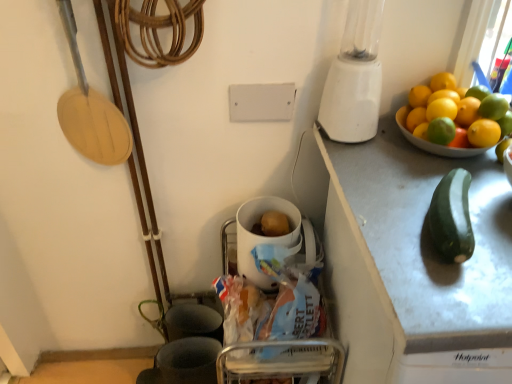
Question: Should I look upward or downward to see yellow matte lemon at right, the second lemon from the bottom?

Choices:
 (A) up
 (B) down

Answer: (A)

Question: Is green matte lemon at upper right, the 6th lemon viewed from the top, outside white glossy mug at center?

Choices:
 (A) no
 (B) yes

Answer: (B)

Question: From the image's perspective, is green matte lemon at upper right, the 6th lemon viewed from the top, on top of white glossy mug at center?

Choices:
 (A) yes
 (B) no

Answer: (A)

Question: Is green matte lemon at upper right, which appears as the 1th lemon when ordered from the bottom, turned away from white glossy mug at center?

Choices:
 (A) yes
 (B) no

Answer: (B)

Question: Is green matte lemon at upper right, which appears as the 1th lemon when ordered from the bottom, smaller than white glossy mug at center?

Choices:
 (A) no
 (B) yes

Answer: (B)

Question: Is green matte lemon at upper right, the 6th lemon viewed from the top, at the right side of white glossy mug at center?

Choices:
 (A) no
 (B) yes

Answer: (B)

Question: Could you tell me if green matte lemon at upper right, the 6th lemon viewed from the top, is turned towards white glossy mug at center?

Choices:
 (A) no
 (B) yes

Answer: (A)

Question: Considering the relative sizes of yellow matte lemon at upper right, arranged as the first lemon when viewed from the top, and yellow matte lemon at upper right, which is the second lemon from top to bottom, in the image provided, is yellow matte lemon at upper right, arranged as the first lemon when viewed from the top, shorter than yellow matte lemon at upper right, which is the second lemon from top to bottom,?

Choices:
 (A) no
 (B) yes

Answer: (A)

Question: Does yellow matte lemon at upper right, arranged as the first lemon when viewed from the top, have a smaller size compared to yellow matte lemon at upper right, which is the second lemon from top to bottom?

Choices:
 (A) no
 (B) yes

Answer: (A)

Question: Does yellow matte lemon at upper right, the sixth lemon positioned from the bottom, have a greater width compared to yellow matte lemon at upper right, which is counted as the 5th lemon, starting from the bottom?

Choices:
 (A) no
 (B) yes

Answer: (A)

Question: Considering the relative sizes of yellow matte lemon at upper right, the sixth lemon positioned from the bottom, and yellow matte lemon at upper right, which is the second lemon from top to bottom, in the image provided, is yellow matte lemon at upper right, the sixth lemon positioned from the bottom, bigger than yellow matte lemon at upper right, which is the second lemon from top to bottom,?

Choices:
 (A) no
 (B) yes

Answer: (B)

Question: From the image's perspective, is yellow matte lemon at upper right, arranged as the first lemon when viewed from the top, located above yellow matte lemon at upper right, which is the second lemon from top to bottom?

Choices:
 (A) no
 (B) yes

Answer: (B)

Question: Is yellow matte lemon at upper right, arranged as the first lemon when viewed from the top, facing towards yellow matte lemon at upper right, which is counted as the 5th lemon, starting from the bottom?

Choices:
 (A) no
 (B) yes

Answer: (B)

Question: Does green matte zucchini at right have a lesser height compared to white plastic blender at upper right?

Choices:
 (A) no
 (B) yes

Answer: (B)